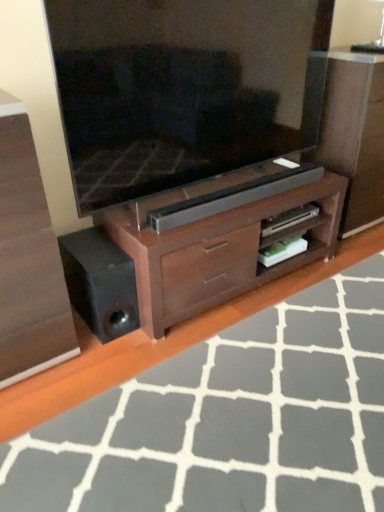
Question: Would you say matte black television at center is part of wooden dresser at center's contents?

Choices:
 (A) yes
 (B) no

Answer: (B)

Question: From a real-world perspective, is wooden dresser at center on matte black television at center?

Choices:
 (A) yes
 (B) no

Answer: (B)

Question: Is matte black television at center at the back of wooden dresser at center?

Choices:
 (A) no
 (B) yes

Answer: (A)

Question: Can you confirm if wooden dresser at center is shorter than matte black television at center?

Choices:
 (A) yes
 (B) no

Answer: (B)

Question: Does wooden dresser at center have a lesser width compared to matte black television at center?

Choices:
 (A) no
 (B) yes

Answer: (A)

Question: From the image's perspective, is matte wood chest of drawers at center above or below matte black television at center?

Choices:
 (A) above
 (B) below

Answer: (B)

Question: Considering the positions of matte wood chest of drawers at center and matte black television at center in the image, is matte wood chest of drawers at center bigger or smaller than matte black television at center?

Choices:
 (A) big
 (B) small

Answer: (A)

Question: Is matte wood chest of drawers at center to the left or to the right of matte black television at center in the image?

Choices:
 (A) right
 (B) left

Answer: (B)

Question: Is matte wood chest of drawers at center in front of or behind matte black television at center in the image?

Choices:
 (A) behind
 (B) front

Answer: (B)

Question: From the image's perspective, is brown wood tv cabinet at center located above or below matte wood chest of drawers at center?

Choices:
 (A) above
 (B) below

Answer: (A)

Question: In terms of height, does brown wood tv cabinet at center look taller or shorter compared to matte wood chest of drawers at center?

Choices:
 (A) tall
 (B) short

Answer: (B)

Question: Looking at their shapes, would you say brown wood tv cabinet at center is wider or thinner than matte wood chest of drawers at center?

Choices:
 (A) wide
 (B) thin

Answer: (A)

Question: Visually, is brown wood tv cabinet at center positioned to the left or to the right of matte wood chest of drawers at center?

Choices:
 (A) left
 (B) right

Answer: (B)

Question: In the image, is wooden floor at lower center positioned in front of or behind wooden dresser at center?

Choices:
 (A) behind
 (B) front

Answer: (B)

Question: Looking at the image, does wooden floor at lower center seem bigger or smaller compared to wooden dresser at center?

Choices:
 (A) big
 (B) small

Answer: (B)